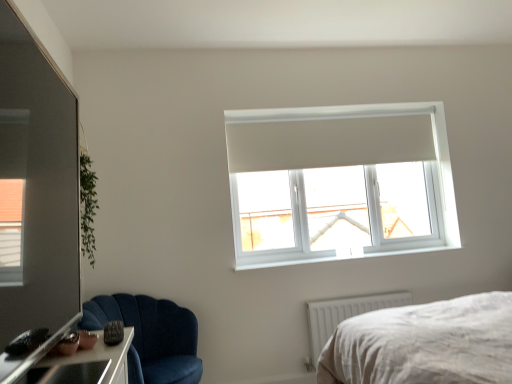
Question: Would you say velvet blue chair at lower left is inside or outside transparent glass door at left?

Choices:
 (A) inside
 (B) outside

Answer: (B)

Question: Based on their sizes in the image, would you say velvet blue chair at lower left is bigger or smaller than transparent glass door at left?

Choices:
 (A) small
 (B) big

Answer: (B)

Question: Estimate the real-world distances between objects in this image. Which object is farther from the white plastic window sill at upper center?

Choices:
 (A) transparent glass door at left
 (B) white plastic radiator at lower right
 (C) velvet blue chair at lower left
 (D) transparent plastic window at upper center

Answer: (A)

Question: Estimate the real-world distances between objects in this image. Which object is farther from the white plastic radiator at lower right?

Choices:
 (A) white plastic window sill at upper center
 (B) transparent glass door at left
 (C) velvet blue chair at lower left
 (D) transparent plastic window at upper center

Answer: (B)